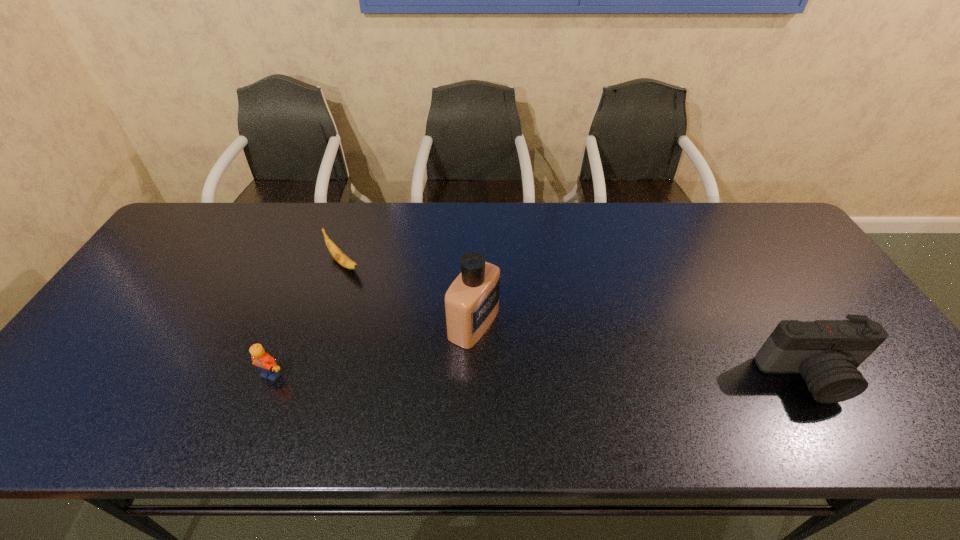
At what (x,y) coordinates should I click in order to perform the action: click on free area in between the third tallest object and the shortest object. Please return your answer as a coordinate pair (x, y). The width and height of the screenshot is (960, 540). Looking at the image, I should click on (307, 319).

Where is `vacant space that is in between the rightmost object and the farthest object`? The width and height of the screenshot is (960, 540). vacant space that is in between the rightmost object and the farthest object is located at coordinates (577, 320).

Where is `unoccupied area between the third object from left to right and the rightmost object`? unoccupied area between the third object from left to right and the rightmost object is located at coordinates (642, 350).

I want to click on empty space between the banana and the tallest object, so click(409, 294).

You are a GUI agent. You are given a task and a screenshot of the screen. Output one action in this format:
    pyautogui.click(x=<x>, y=<y>)
    Task: Click on the object that stands as the closest to the perfume
    This screenshot has width=960, height=540.
    Given the screenshot: What is the action you would take?
    pyautogui.click(x=338, y=255)

I want to click on the second closest object to the perfume, so click(270, 370).